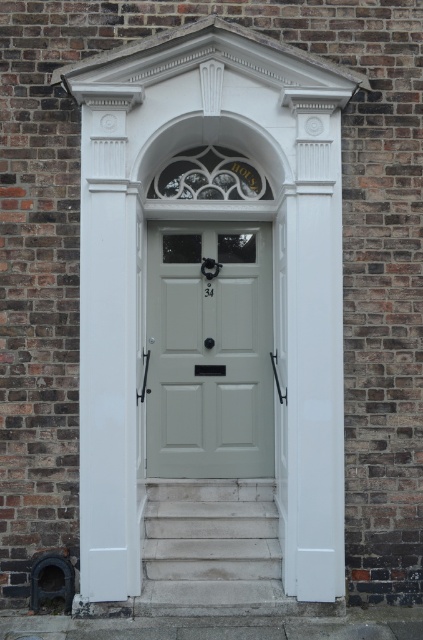
Does satin white door at center have a lesser width compared to white stone stairs at lower center?

Yes.

Describe the element at coordinates (208, 349) in the screenshot. I see `satin white door at center` at that location.

You are a GUI agent. You are given a task and a screenshot of the screen. Output one action in this format:
    pyautogui.click(x=<x>, y=<y>)
    Task: Click on the satin white door at center
    The height and width of the screenshot is (640, 423).
    Given the screenshot: What is the action you would take?
    pyautogui.click(x=208, y=349)